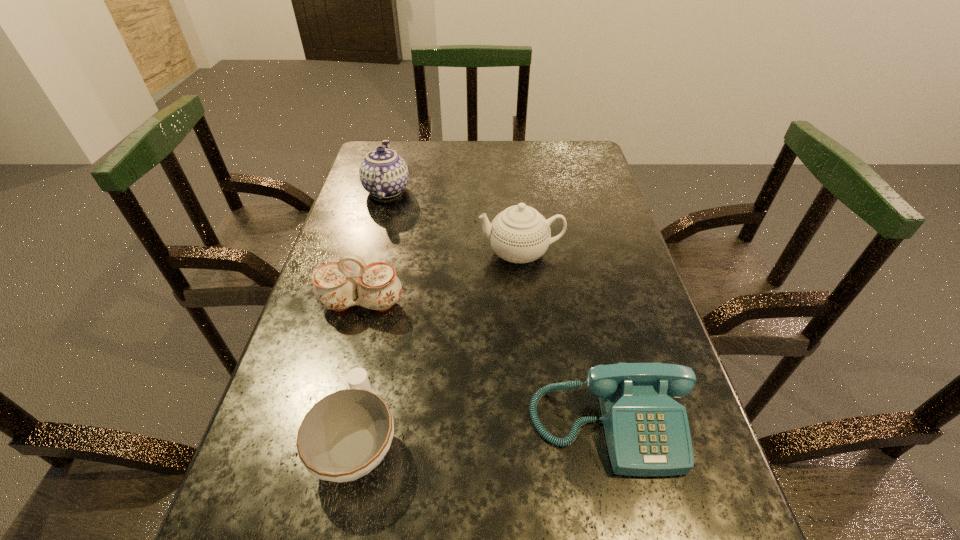
Locate an element on the screen. This screenshot has width=960, height=540. vacant space located by the handle of the third farthest chinaware is located at coordinates (307, 512).

The width and height of the screenshot is (960, 540). I want to click on free space located at the spout of the farthest chinaware, so click(x=540, y=191).

Identify the location of vacant space located on the dial of the telephone. Image resolution: width=960 pixels, height=540 pixels. (631, 519).

The image size is (960, 540). I want to click on vacant space situated on the side with the handle of the nearest chinaware, so [x=387, y=298].

This screenshot has height=540, width=960. In order to click on vacant area located on the side with the handle of the nearest chinaware in this screenshot , I will do `click(380, 329)`.

What are the coordinates of `vacant space located 0.280m on the side with the handle of the nearest chinaware` in the screenshot? It's located at (389, 285).

This screenshot has width=960, height=540. I want to click on object present at the far edge, so click(383, 173).

The image size is (960, 540). I want to click on object located at the right edge, so click(x=647, y=432).

You are a GUI agent. You are given a task and a screenshot of the screen. Output one action in this format:
    pyautogui.click(x=<x>, y=<y>)
    Task: Click on the object that is at the far left corner
    
    Given the screenshot: What is the action you would take?
    pyautogui.click(x=383, y=173)

The image size is (960, 540). What are the coordinates of `blank space at the far edge of the desktop` in the screenshot? It's located at (501, 153).